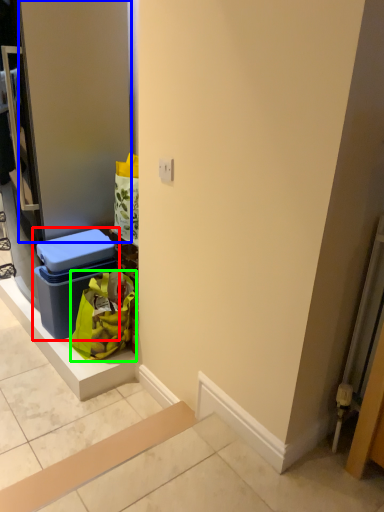
Question: Considering the real-world distances, which object is farthest from storage box (highlighted by a red box)? door (highlighted by a blue box) or shopping bag (highlighted by a green box)?

Choices:
 (A) door
 (B) shopping bag

Answer: (A)